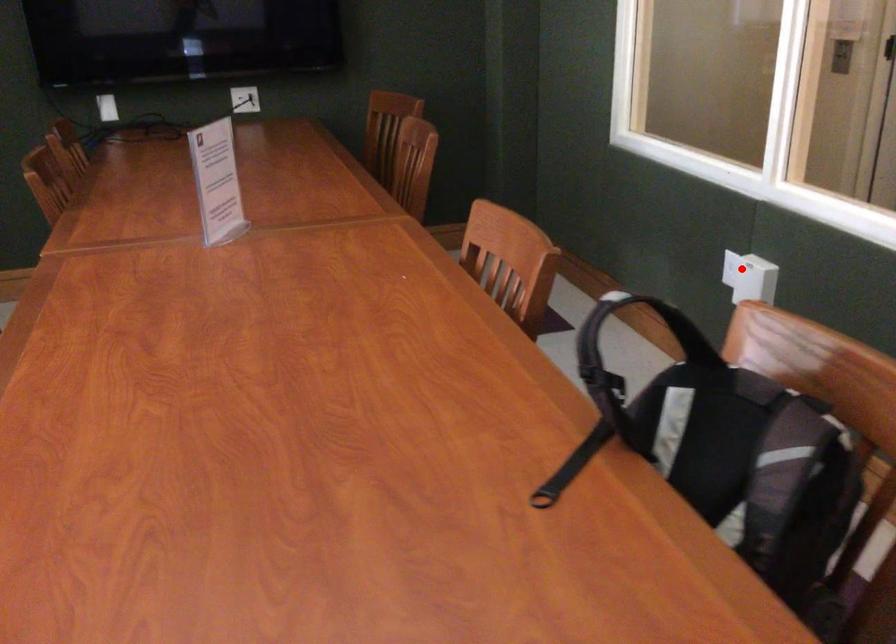
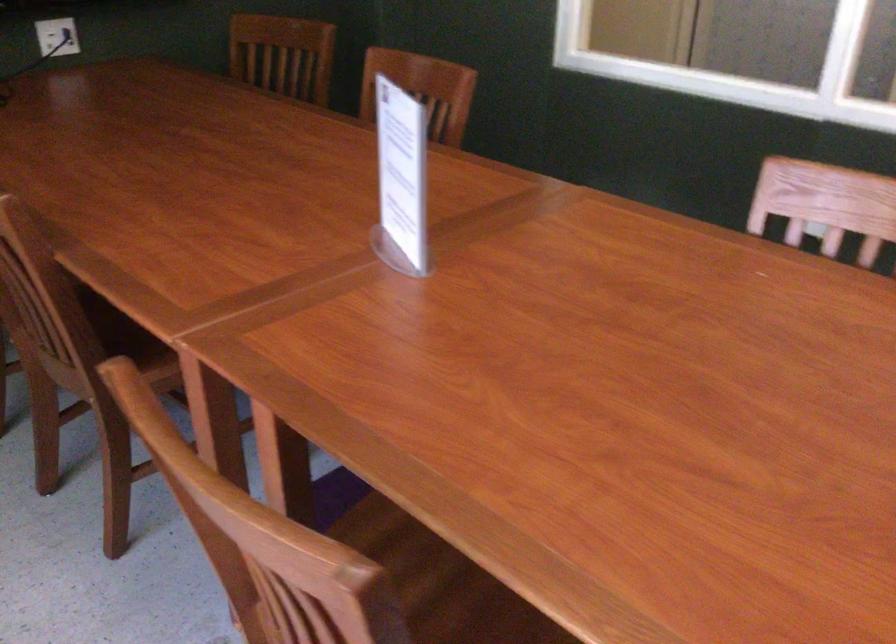
Question: I am providing you with two images of the same scene from different viewpoints. A red point is marked on the first image. Can you still see the location of the red point in image 2?

Choices:
 (A) Yes
 (B) No

Answer: (B)